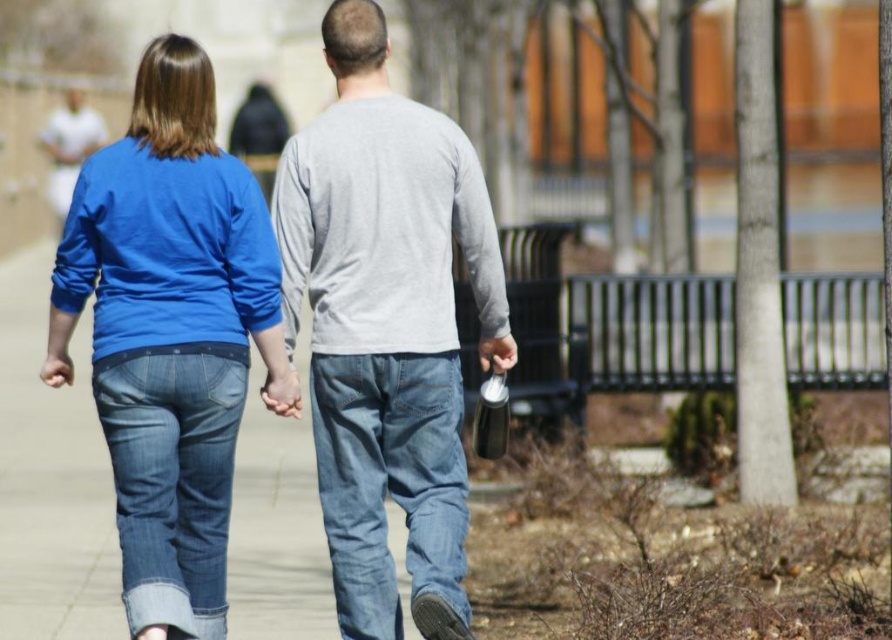
Can you confirm if gray cotton shirt at center is taller than denim jeans at center?

In fact, gray cotton shirt at center may be shorter than denim jeans at center.

The image size is (892, 640). What do you see at coordinates (383, 228) in the screenshot? I see `gray cotton shirt at center` at bounding box center [383, 228].

Find the location of a particular element. gray cotton shirt at center is located at coordinates (383, 228).

Does denim jeans at center appear on the left side of denim jeans at lower left?

In fact, denim jeans at center is to the right of denim jeans at lower left.

Can you confirm if denim jeans at center is bigger than denim jeans at lower left?

Yes, denim jeans at center is bigger than denim jeans at lower left.

This screenshot has height=640, width=892. Describe the element at coordinates (390, 483) in the screenshot. I see `denim jeans at center` at that location.

I want to click on denim jeans at center, so click(390, 483).

Between gray cotton shirt at center and denim jeans at lower left, which one has less height?

gray cotton shirt at center

Which is behind, point (356, 108) or point (201, 636)?

Point (356, 108)

Find the location of a particular element. This screenshot has height=640, width=892. gray cotton shirt at center is located at coordinates (383, 228).